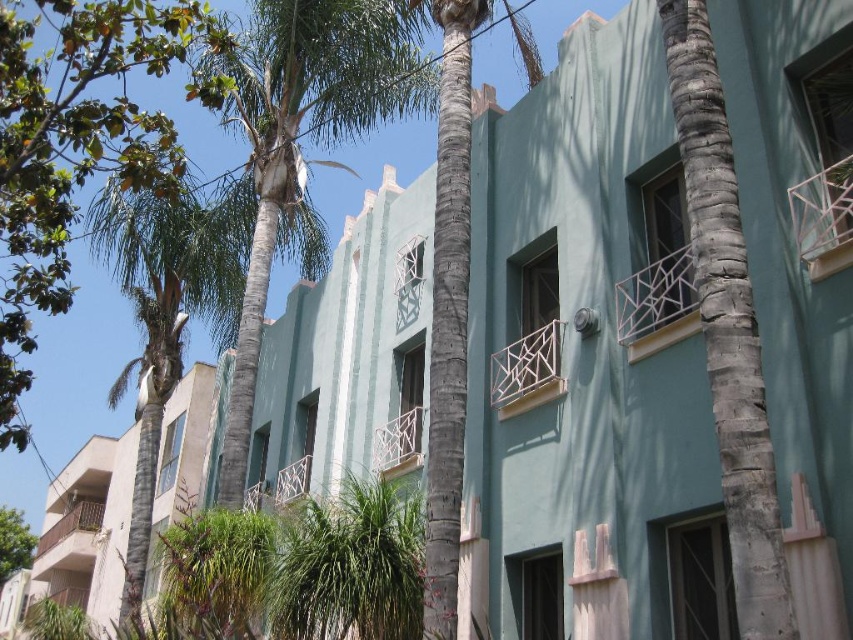
You are an urban planner analyzing the building and its surroundings. Which of the two green leafy trees, the green leafy palm tree at upper left or the green leafy tree at lower left, has a bigger canopy? Please base your answer on their sizes as depicted in the image.

The green leafy palm tree at upper left is larger in size than the green leafy tree at lower left, so its canopy is bigger.

You are a city planner analyzing the urban space in front of the teal building. You need to determine which tree has a narrower trunk between the gray textured palm tree at center and the green leafy tree at lower left. Which one is it?

The gray textured palm tree at center is thinner than the green leafy tree at lower left, so the gray textured palm tree at center has a narrower trunk.

You are a city planner assessing the space between the beige concrete building at left and the green leafy tree at lower left. Based on their widths, which one occupies more horizontal space in the scene?

The beige concrete building at left occupies more horizontal space because its width surpasses that of the green leafy tree at lower left.